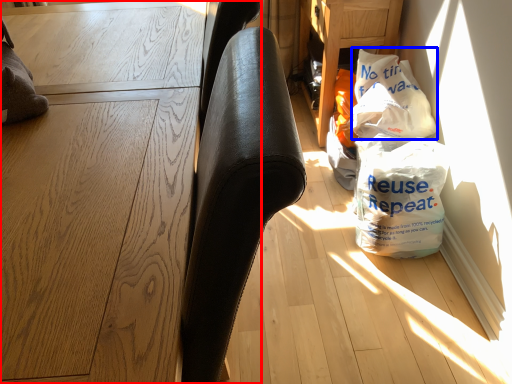
Question: Which of the following is the farthest to the observer, furniture (highlighted by a red box) or grocery bag (highlighted by a blue box)?

Choices:
 (A) furniture
 (B) grocery bag

Answer: (B)